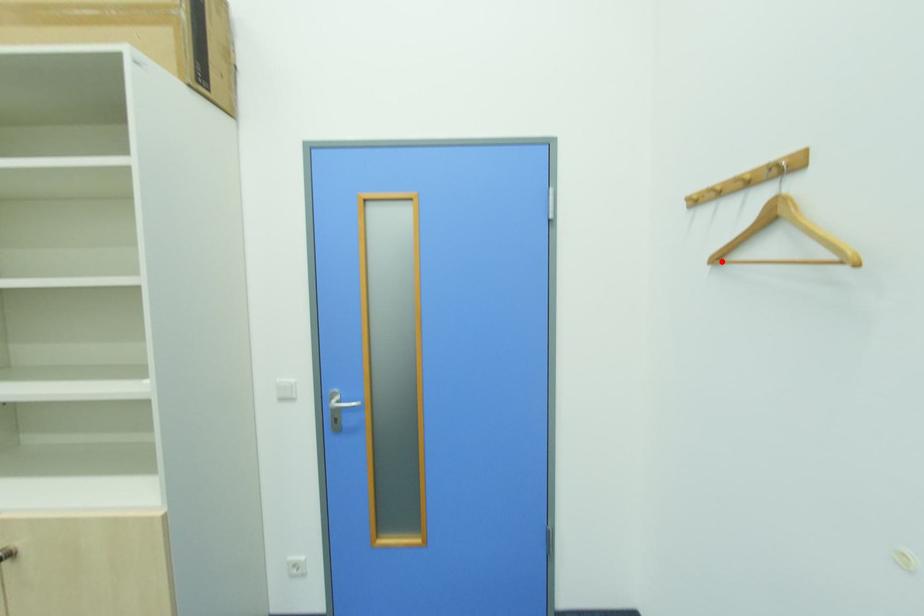
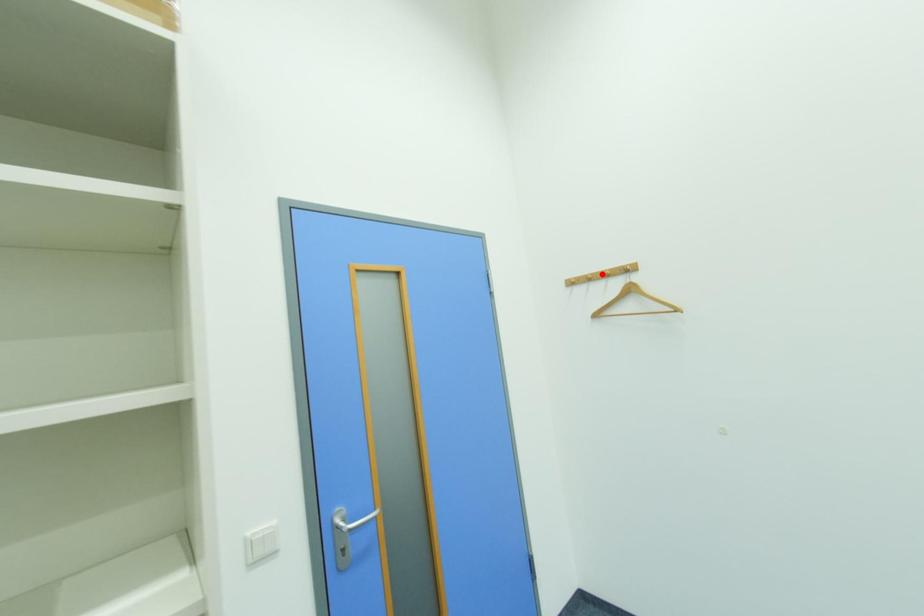
I am providing you with two images of the same scene from different viewpoints. A red point is marked on the first image and another point is marked on the second image. Is the red point in image1 aligned with the point shown in image2?

No